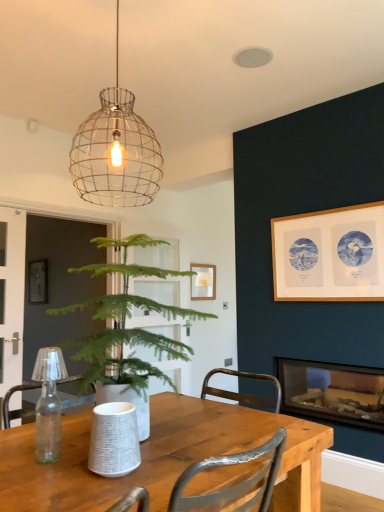
Question: In terms of height, does wire mesh pendant light at upper center look taller or shorter compared to wooden picture frame at upper right?

Choices:
 (A) tall
 (B) short

Answer: (A)

Question: Is point (107, 93) closer or farther from the camera than point (357, 257)?

Choices:
 (A) farther
 (B) closer

Answer: (B)

Question: Which of these objects is positioned closest to the wooden table at center?

Choices:
 (A) wooden picture frame at upper right
 (B) wire mesh pendant light at upper center
 (C) green leafy plant at center
 (D) glass fireplace at lower right

Answer: (C)

Question: Based on their relative distances, which object is nearer to the green leafy plant at center?

Choices:
 (A) glass fireplace at lower right
 (B) wooden picture frame at upper right
 (C) wooden table at center
 (D) wire mesh pendant light at upper center

Answer: (C)